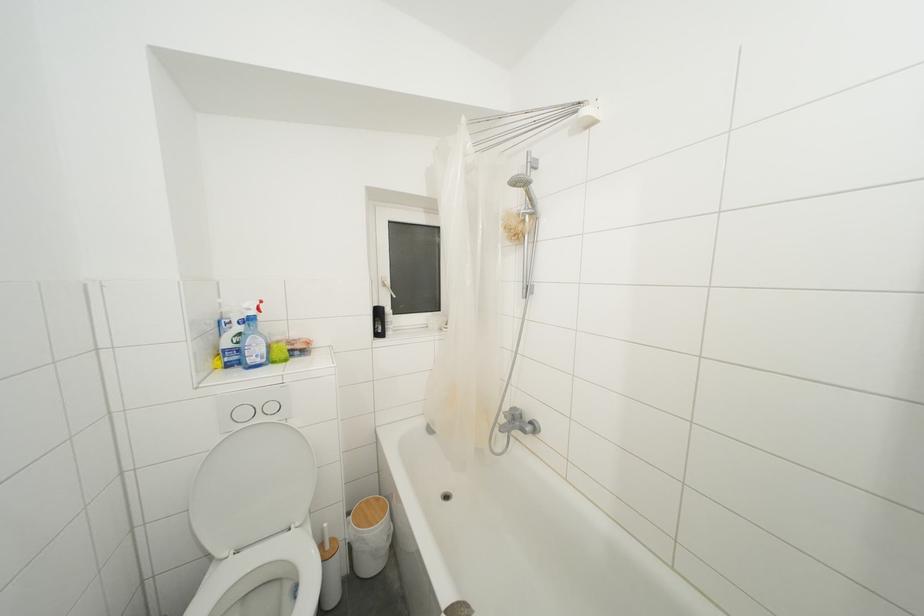
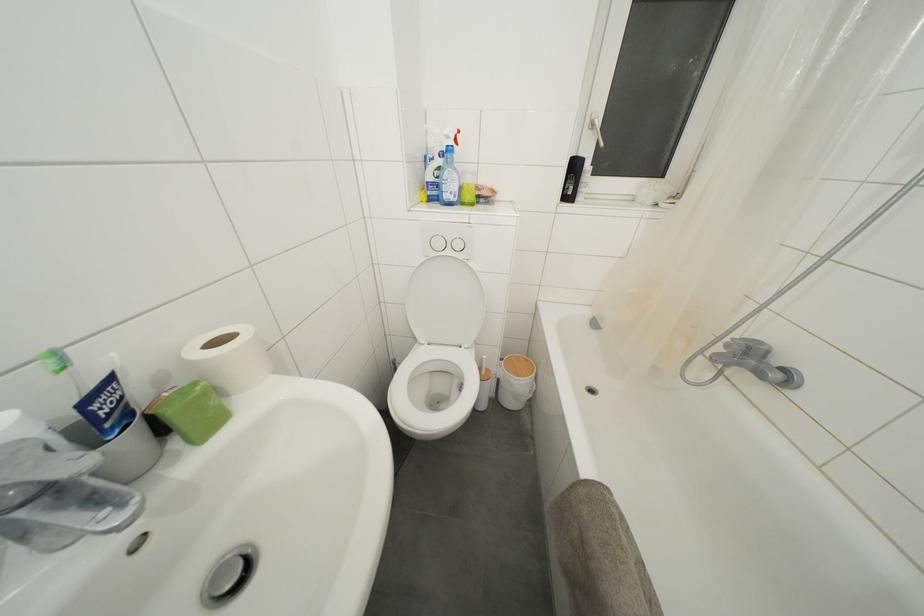
Based on the continuous images, in which direction is the camera rotating?

The camera's rotation is toward left-down.